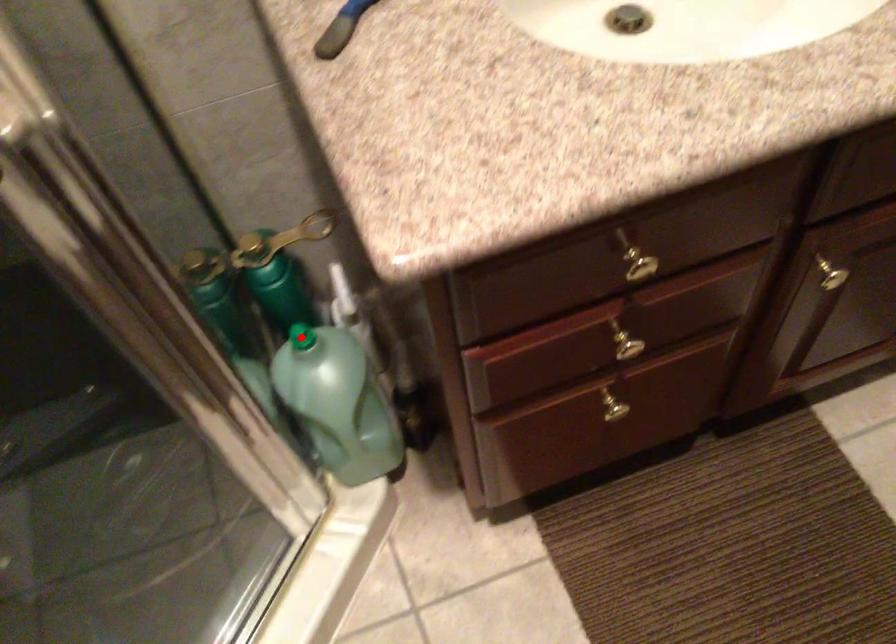
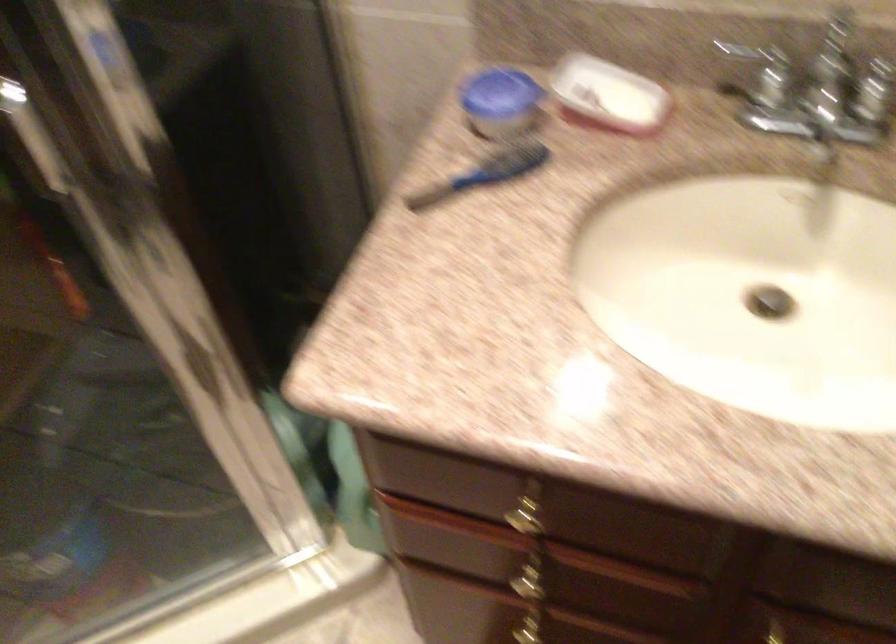
Question: I am providing you with two images of the same scene from different viewpoints. A red point is marked on the first image. At the location where the point appears in image 1, is it still visible in image 2?

Choices:
 (A) Yes
 (B) No

Answer: (B)